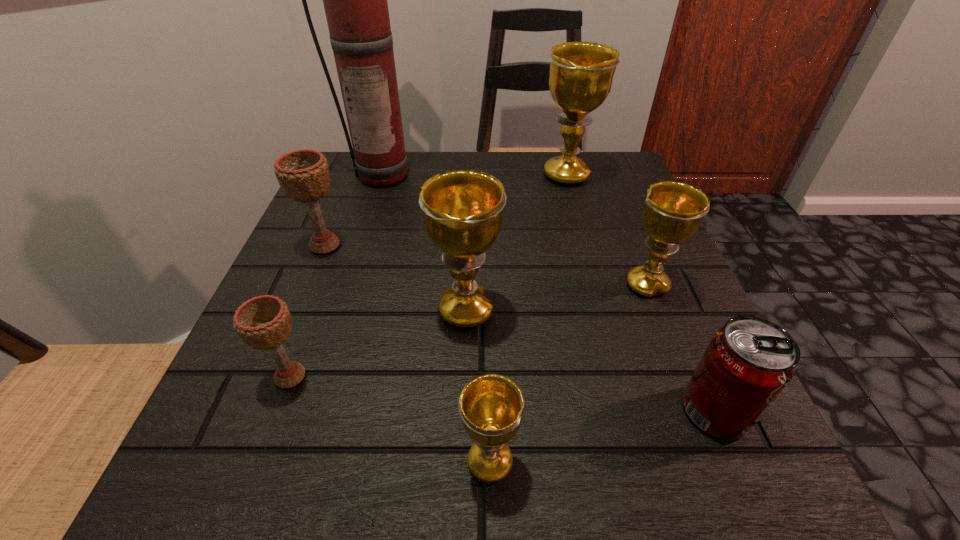
Identify which gold chalice is the third closest to the fire extinguisher. Please provide its 2D coordinates. Your answer should be formatted as a tuple, i.e. [(x, y)], where the tuple contains the x and y coordinates of a point satisfying the conditions above.

[(673, 211)]

Find the location of a particular element. Image resolution: width=960 pixels, height=540 pixels. the second closest gold chalice to the smaller beige chalice is located at coordinates (491, 406).

At what (x,y) coordinates should I click in order to perform the action: click on blank area in the image that satisfies the following two spatial constraints: 1. on the side of the tallest object with the label and nozzle; 2. on the left side of the third biggest gold chalice. Please return your answer as a coordinate pair (x, y). This screenshot has width=960, height=540. Looking at the image, I should click on (349, 285).

Where is `free spot that satisfies the following two spatial constraints: 1. on the back side of the seventh shortest object; 2. on the left side of the sixth nearest object`? This screenshot has width=960, height=540. free spot that satisfies the following two spatial constraints: 1. on the back side of the seventh shortest object; 2. on the left side of the sixth nearest object is located at coordinates (353, 176).

Find the location of a particular element. This screenshot has width=960, height=540. vacant area in the image that satisfies the following two spatial constraints: 1. on the side of the fire extinguisher with the label and nozzle; 2. on the left side of the pop soda is located at coordinates (311, 411).

Where is `free spot that satisfies the following two spatial constraints: 1. on the side of the fire extinguisher with the label and nozzle; 2. on the right side of the second smallest gold chalice`? Image resolution: width=960 pixels, height=540 pixels. free spot that satisfies the following two spatial constraints: 1. on the side of the fire extinguisher with the label and nozzle; 2. on the right side of the second smallest gold chalice is located at coordinates (349, 285).